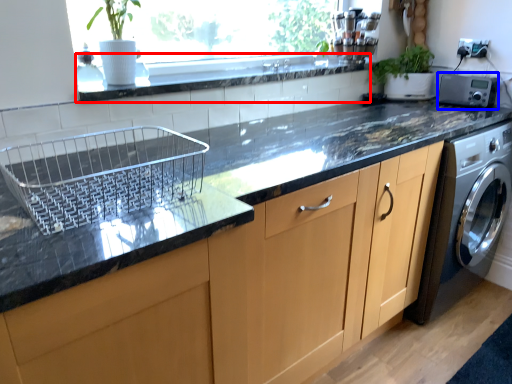
Question: Which object appears farthest to the camera in this image, window sill (highlighted by a red box) or appliance (highlighted by a blue box)?

Choices:
 (A) window sill
 (B) appliance

Answer: (B)